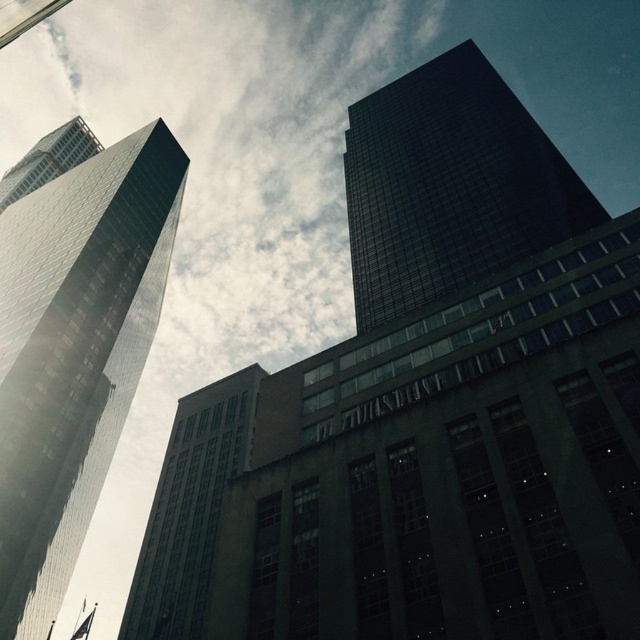
Is point (61, 301) behind point (49, 166)?

No, it is not.

Between reflective glass skyscraper at left and glassy reflective skyscraper at upper left, which one is positioned higher?

Positioned higher is glassy reflective skyscraper at upper left.

This screenshot has height=640, width=640. What are the coordinates of `reflective glass skyscraper at left` in the screenshot? It's located at (74, 353).

What do you see at coordinates (449, 186) in the screenshot?
I see `dark glass skyscraper at upper right` at bounding box center [449, 186].

Describe the element at coordinates (449, 186) in the screenshot. I see `dark glass skyscraper at upper right` at that location.

At what (x,y) coordinates should I click in order to perform the action: click on dark glass skyscraper at upper right. Please return your answer as a coordinate pair (x, y). The width and height of the screenshot is (640, 640). Looking at the image, I should click on (449, 186).

From the picture: Which of these two, reflective glass skyscraper at left or dark glass skyscraper at upper right, stands taller?

reflective glass skyscraper at left

Can you confirm if reflective glass skyscraper at left is smaller than dark glass skyscraper at upper right?

No.

Between point (124, 214) and point (477, 248), which one is positioned behind?

Point (124, 214)

The width and height of the screenshot is (640, 640). I want to click on reflective glass skyscraper at left, so click(x=74, y=353).